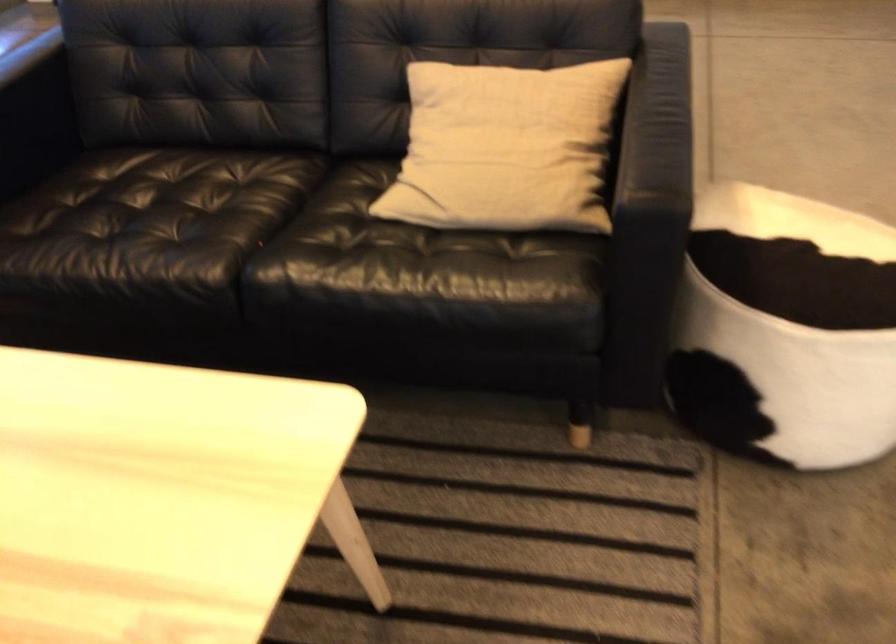
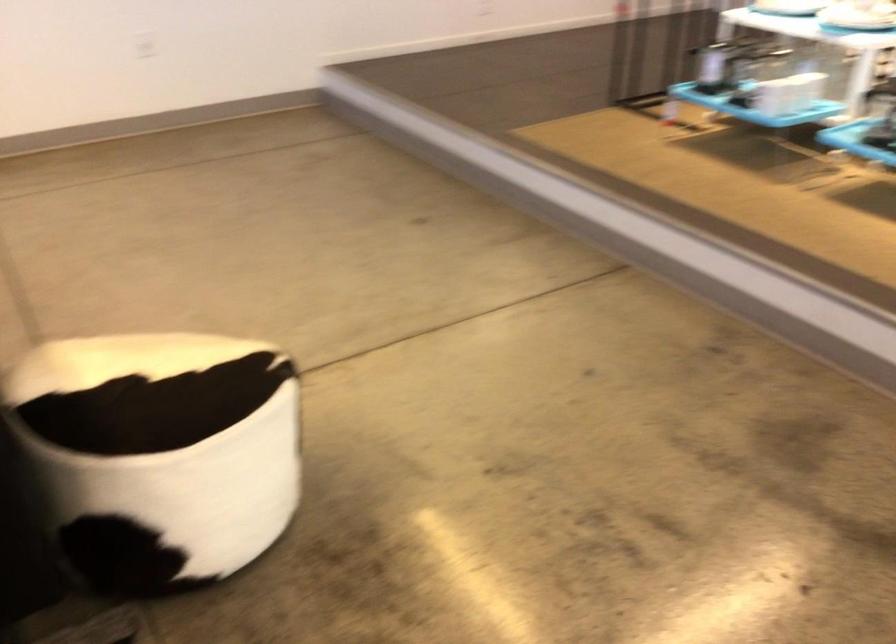
Question: The camera is either moving clockwise (left) or counter-clockwise (right) around the object. The first image is from the beginning of the video and the second image is from the end. Is the camera moving left or right when shooting the video?

Choices:
 (A) Left
 (B) Right

Answer: (A)